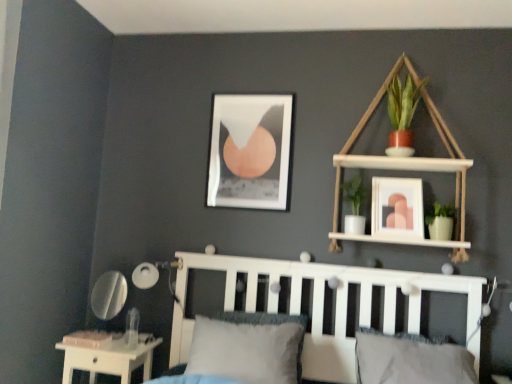
At what (x,y) coordinates should I click in order to perform the action: click on matte black picture frame at upper center, arranged as the first picture frame when viewed from the left. Please return your answer as a coordinate pair (x, y). This screenshot has width=512, height=384. Looking at the image, I should click on (250, 151).

What is the approximate height of white matte lamp at lower left?

The height of white matte lamp at lower left is 23.87 centimeters.

Identify the location of gray textured pillow at center, the 2th pillow from the right. (248, 346).

Describe the element at coordinates (411, 359) in the screenshot. I see `gray fabric pillow at lower center, marked as the 1th pillow in a right-to-left arrangement` at that location.

Where is `gray fabric pillow at lower center, marked as the 1th pillow in a right-to-left arrangement`? Image resolution: width=512 pixels, height=384 pixels. gray fabric pillow at lower center, marked as the 1th pillow in a right-to-left arrangement is located at coordinates (411, 359).

This screenshot has height=384, width=512. What do you see at coordinates (397, 207) in the screenshot?
I see `matte pink picture frame at upper center, positioned as the 1th picture frame in right-to-left order` at bounding box center [397, 207].

This screenshot has height=384, width=512. What do you see at coordinates (408, 160) in the screenshot?
I see `white wood bookshelf at upper right` at bounding box center [408, 160].

Find the location of a particular element. The height and width of the screenshot is (384, 512). white wood bookshelf at upper right is located at coordinates (408, 160).

You are a GUI agent. You are given a task and a screenshot of the screen. Output one action in this format:
    pyautogui.click(x=<x>, y=<y>)
    Task: Click on the matte black picture frame at upper center, the second picture frame positioned from the front
    The image size is (512, 384).
    Given the screenshot: What is the action you would take?
    pyautogui.click(x=250, y=151)

Is matte black picture frame at upper center, the second picture frame positioned from the front, at the back of white wood bookshelf at upper right?

No.

Where is `the 1st picture frame below the white wood bookshelf at upper right (from a real-world perspective)`? This screenshot has width=512, height=384. the 1st picture frame below the white wood bookshelf at upper right (from a real-world perspective) is located at coordinates (250, 151).

Based on the photo, does white wood bookshelf at upper right have a larger size compared to matte black picture frame at upper center, the second picture frame positioned from the front?

Yes.

Which object is wider, white wood bookshelf at upper right or matte black picture frame at upper center, which ranks as the second picture frame in right-to-left order?

white wood bookshelf at upper right is wider.

Is white matte lamp at lower left wider or thinner than white wooden bed frame at center?

In the image, white matte lamp at lower left appears to be more narrow than white wooden bed frame at center.

Is white matte lamp at lower left not near white wooden bed frame at center?

Actually, white matte lamp at lower left and white wooden bed frame at center are a little close together.

Is white matte lamp at lower left facing towards white wooden bed frame at center?

No, white matte lamp at lower left is not oriented towards white wooden bed frame at center.

Which is in front, point (169, 272) or point (180, 278)?

The point (180, 278) is more forward.

Between white matte lamp at lower left and white wood bookshelf at upper right, which one has less height?

white matte lamp at lower left.

From the image's perspective, is white matte lamp at lower left located above or below white wood bookshelf at upper right?

white matte lamp at lower left is below white wood bookshelf at upper right.

What are the coordinates of `lamp located behind the white wood bookshelf at upper right` in the screenshot? It's located at (154, 275).

Would you say gray textured pillow at center, the 2th pillow from the right, is outside white wooden bed frame at center?

That's incorrect, gray textured pillow at center, the 2th pillow from the right, is not completely outside white wooden bed frame at center.

From a real-world perspective, is gray textured pillow at center, which appears as the first pillow when viewed from the left, beneath white wooden bed frame at center?

Correct, in the physical world, gray textured pillow at center, which appears as the first pillow when viewed from the left, is lower than white wooden bed frame at center.

From the image's perspective, which one is positioned lower, gray textured pillow at center, the 2th pillow from the right, or white wooden bed frame at center?

From the image's view, gray textured pillow at center, the 2th pillow from the right, is below.

Does gray textured pillow at center, which appears as the first pillow when viewed from the left, have a lesser width compared to matte pink picture frame at upper center, arranged as the first picture frame when viewed from the front?

→ No, gray textured pillow at center, which appears as the first pillow when viewed from the left, is not thinner than matte pink picture frame at upper center, arranged as the first picture frame when viewed from the front.

From a real-world perspective, which is physically below, gray textured pillow at center, the 2th pillow from the right, or matte pink picture frame at upper center, which is counted as the 2th picture frame, starting from the left?

In real-world perspective, gray textured pillow at center, the 2th pillow from the right, is lower.

From the image's perspective, between gray textured pillow at center, which appears as the first pillow when viewed from the left, and matte pink picture frame at upper center, which ranks as the 2th picture frame in back-to-front order, which one is located above?

matte pink picture frame at upper center, which ranks as the 2th picture frame in back-to-front order.

Can you tell me how much gray textured pillow at center, which appears as the first pillow when viewed from the left, and matte pink picture frame at upper center, positioned as the 1th picture frame in right-to-left order, differ in facing direction?

gray textured pillow at center, which appears as the first pillow when viewed from the left, and matte pink picture frame at upper center, positioned as the 1th picture frame in right-to-left order, are facing 2.97 degrees away from each other.

Is white glossy table at lower left aimed at matte black picture frame at upper center, acting as the 1th picture frame starting from the back?

No, white glossy table at lower left is not turned towards matte black picture frame at upper center, acting as the 1th picture frame starting from the back.

Considering the relative positions of white glossy table at lower left and matte black picture frame at upper center, which ranks as the second picture frame in right-to-left order, in the image provided, is white glossy table at lower left to the left or to the right of matte black picture frame at upper center, which ranks as the second picture frame in right-to-left order,?

white glossy table at lower left is to the left of matte black picture frame at upper center, which ranks as the second picture frame in right-to-left order.

From a real-world perspective, is white glossy table at lower left physically below matte black picture frame at upper center, the second picture frame positioned from the front?

Correct, in the physical world, white glossy table at lower left is lower than matte black picture frame at upper center, the second picture frame positioned from the front.

Which is in front, white glossy table at lower left or matte black picture frame at upper center, arranged as the first picture frame when viewed from the left?

white glossy table at lower left.

From the image's perspective, is matte pink picture frame at upper center, arranged as the first picture frame when viewed from the front, located beneath gray textured pillow at center, which appears as the first pillow when viewed from the left?

No.

In the scene shown: Which is more to the left, matte pink picture frame at upper center, positioned as the 1th picture frame in right-to-left order, or gray textured pillow at center, the 2th pillow from the right?

gray textured pillow at center, the 2th pillow from the right.

Which of these two, matte pink picture frame at upper center, positioned as the 1th picture frame in right-to-left order, or gray textured pillow at center, which appears as the first pillow when viewed from the left, is thinner?

matte pink picture frame at upper center, positioned as the 1th picture frame in right-to-left order.

Looking at the image, does matte pink picture frame at upper center, which ranks as the 2th picture frame in back-to-front order, seem bigger or smaller compared to gray textured pillow at center, the 2th pillow from the right?

Considering their sizes, matte pink picture frame at upper center, which ranks as the 2th picture frame in back-to-front order, takes up less space than gray textured pillow at center, the 2th pillow from the right.

This screenshot has width=512, height=384. What are the coordinates of `picture frame above the white wood bookshelf at upper right (from the image's perspective)` in the screenshot? It's located at (250, 151).

Where is `lamp lying behind the white wooden bed frame at center`? lamp lying behind the white wooden bed frame at center is located at coordinates (154, 275).

Considering their positions, is white wooden bed frame at center positioned closer to gray fabric pillow at lower center, which ranks as the 2th pillow in left-to-right order, than matte black picture frame at upper center, arranged as the first picture frame when viewed from the left?

Among the two, white wooden bed frame at center is located nearer to gray fabric pillow at lower center, which ranks as the 2th pillow in left-to-right order.

Considering their positions, is matte black picture frame at upper center, arranged as the first picture frame when viewed from the left, positioned closer to white wood bookshelf at upper right than gray textured pillow at center, the 2th pillow from the right?

matte black picture frame at upper center, arranged as the first picture frame when viewed from the left, lies closer to white wood bookshelf at upper right than the other object.

When comparing their distances from matte black picture frame at upper center, which ranks as the second picture frame in right-to-left order, does white matte lamp at lower left or white glossy table at lower left seem closer?

white matte lamp at lower left.

Considering their positions, is white wooden bed frame at center positioned closer to matte black picture frame at upper center, arranged as the first picture frame when viewed from the left, than gray fabric pillow at lower center, marked as the 1th pillow in a right-to-left arrangement?

white wooden bed frame at center lies closer to matte black picture frame at upper center, arranged as the first picture frame when viewed from the left, than the other object.

From the image, which object appears to be nearer to matte pink picture frame at upper center, positioned as the 1th picture frame in right-to-left order, white wood bookshelf at upper right or white matte lamp at lower left?

white wood bookshelf at upper right is positioned closer to the anchor matte pink picture frame at upper center, positioned as the 1th picture frame in right-to-left order.

Which object lies further to the anchor point matte black picture frame at upper center, the second picture frame positioned from the front, gray fabric pillow at lower center, which ranks as the 2th pillow in left-to-right order, or matte pink picture frame at upper center, which ranks as the 2th picture frame in back-to-front order?

Among the two, gray fabric pillow at lower center, which ranks as the 2th pillow in left-to-right order, is located further to matte black picture frame at upper center, the second picture frame positioned from the front.

Considering their positions, is white glossy table at lower left positioned further to white wood bookshelf at upper right than gray fabric pillow at lower center, which ranks as the 2th pillow in left-to-right order?

Based on the image, white glossy table at lower left appears to be further to white wood bookshelf at upper right.

Looking at the image, which one is located closer to white wood bookshelf at upper right, white wooden bed frame at center or gray fabric pillow at lower center, marked as the 1th pillow in a right-to-left arrangement?

white wooden bed frame at center is positioned closer to the anchor white wood bookshelf at upper right.

Identify the location of bookshelf that lies between matte black picture frame at upper center, the second picture frame positioned from the front, and gray fabric pillow at lower center, which ranks as the 2th pillow in left-to-right order, from top to bottom. (408, 160).

Identify the location of bookshelf that lies between matte black picture frame at upper center, which ranks as the second picture frame in right-to-left order, and gray textured pillow at center, which appears as the first pillow when viewed from the left, from top to bottom. The width and height of the screenshot is (512, 384). (408, 160).

Find the location of a particular element. lamp located between white glossy table at lower left and gray textured pillow at center, the 2th pillow from the right, in the left-right direction is located at coordinates (154, 275).

The width and height of the screenshot is (512, 384). In order to click on picture frame located between white glossy table at lower left and gray fabric pillow at lower center, marked as the 1th pillow in a right-to-left arrangement, in the left-right direction in this screenshot , I will do point(250,151).